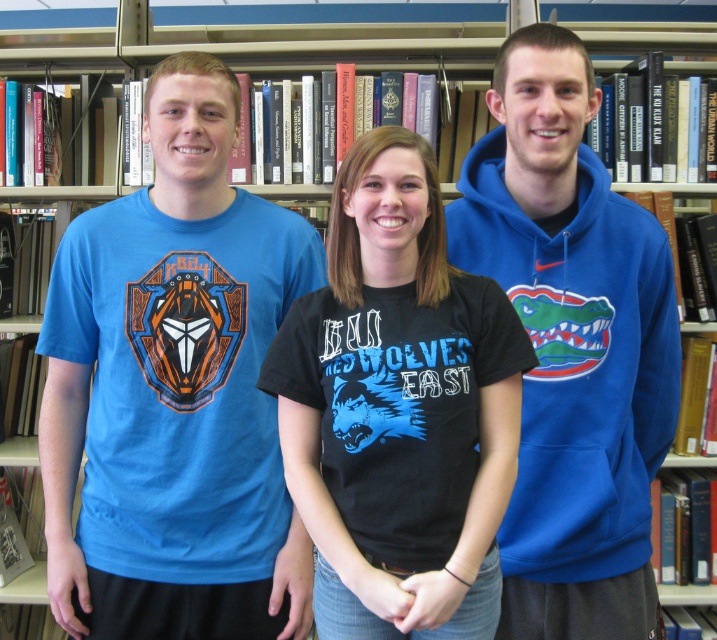
Between matte blue t-shirt at center and blue fleece hoodie at center, which one has more height?

matte blue t-shirt at center

Consider the image. Is matte blue t-shirt at center to the right of blue fleece hoodie at center from the viewer's perspective?

No, matte blue t-shirt at center is not to the right of blue fleece hoodie at center.

Which is in front, point (70, 560) or point (576, 150)?

Point (576, 150)

This screenshot has width=717, height=640. Identify the location of matte blue t-shirt at center. (174, 390).

Can you confirm if matte blue t-shirt at center is bigger than black matte t-shirt at center?

Yes.

Which is above, matte blue t-shirt at center or black matte t-shirt at center?

Positioned higher is matte blue t-shirt at center.

Is point (80, 580) behind point (419, 454)?

Yes, point (80, 580) is behind point (419, 454).

Identify the location of matte blue t-shirt at center. The image size is (717, 640). (174, 390).

Based on the photo, is black matte t-shirt at center positioned behind blue fleece hoodie at center?

No, black matte t-shirt at center is in front of blue fleece hoodie at center.

Describe the element at coordinates (398, 408) in the screenshot. I see `black matte t-shirt at center` at that location.

Is point (360, 372) more distant than point (523, 513)?

That is False.

Where is `black matte t-shirt at center`? Image resolution: width=717 pixels, height=640 pixels. black matte t-shirt at center is located at coordinates (398, 408).